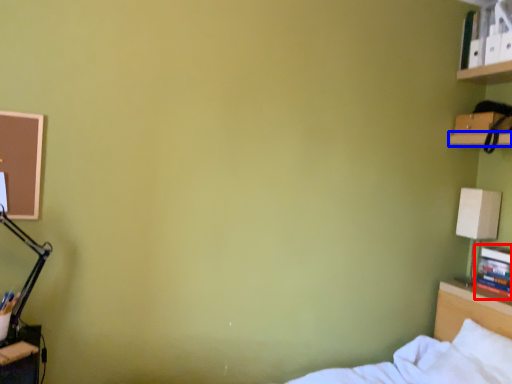
Question: Among these objects, which one is nearest to the camera, book (highlighted by a red box) or shelf (highlighted by a blue box)?

Choices:
 (A) book
 (B) shelf

Answer: (B)